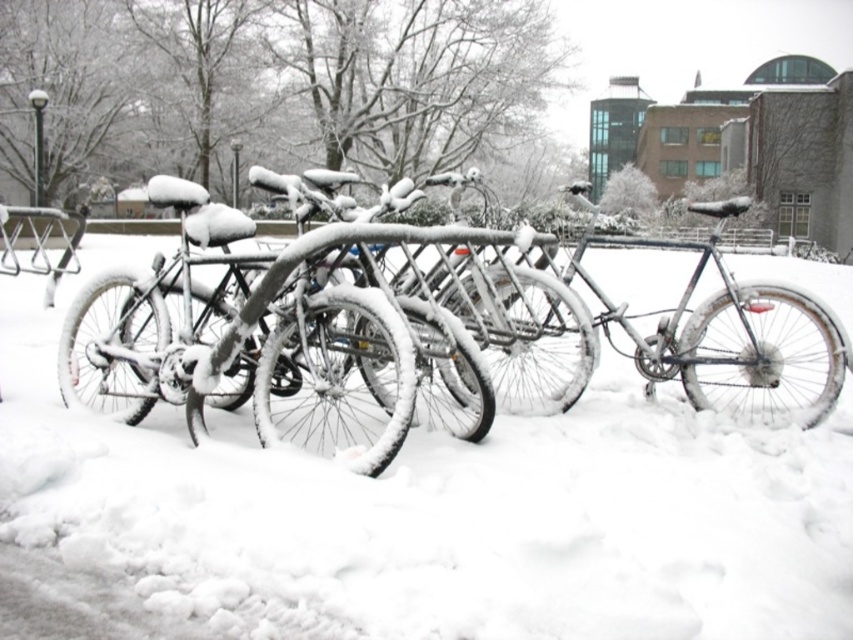
Is white fluffy snow at center closer to the viewer compared to shiny silver bicycle at center?

Yes.

Who is more forward, (660, 448) or (543, 340)?

Point (660, 448) is in front.

This screenshot has height=640, width=853. Find the location of `white fluffy snow at center`. white fluffy snow at center is located at coordinates (434, 512).